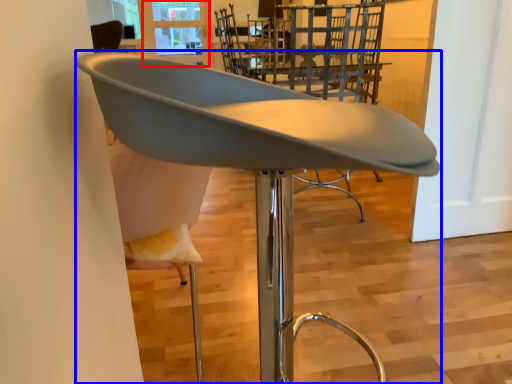
Question: Which of the following is the farthest to the observer, window screen (highlighted by a red box) or chair (highlighted by a blue box)?

Choices:
 (A) window screen
 (B) chair

Answer: (A)